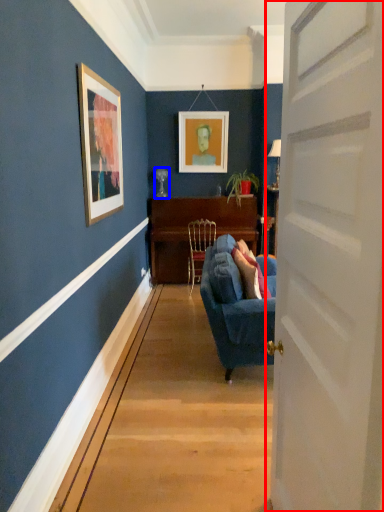
Question: Among these objects, which one is nearest to the camera, door (highlighted by a red box) or lamp (highlighted by a blue box)?

Choices:
 (A) door
 (B) lamp

Answer: (A)